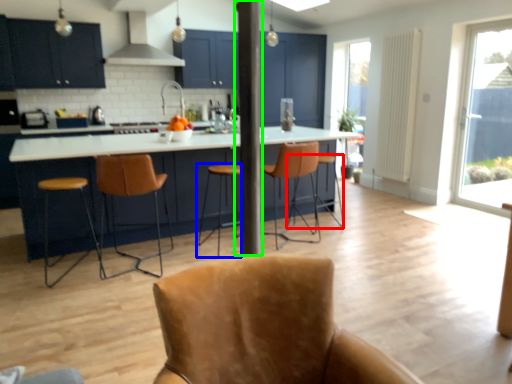
Question: Estimate the real-world distances between objects in this image. Which object is farther from bar stool (highlighted by a red box), bar stool (highlighted by a blue box) or pole (highlighted by a green box)?

Choices:
 (A) bar stool
 (B) pole

Answer: (B)